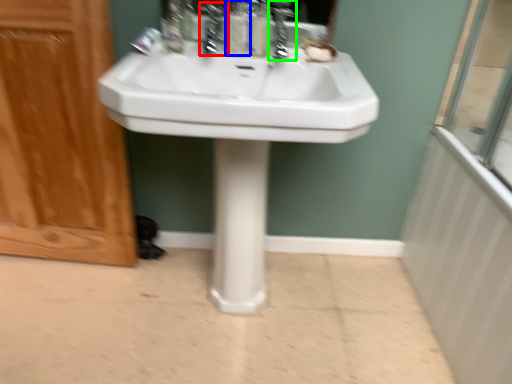
Question: Considering the real-world distances, which object is closest to faucet (highlighted by a red box)? soap dispenser (highlighted by a blue box) or faucet (highlighted by a green box).

Choices:
 (A) soap dispenser
 (B) faucet

Answer: (A)